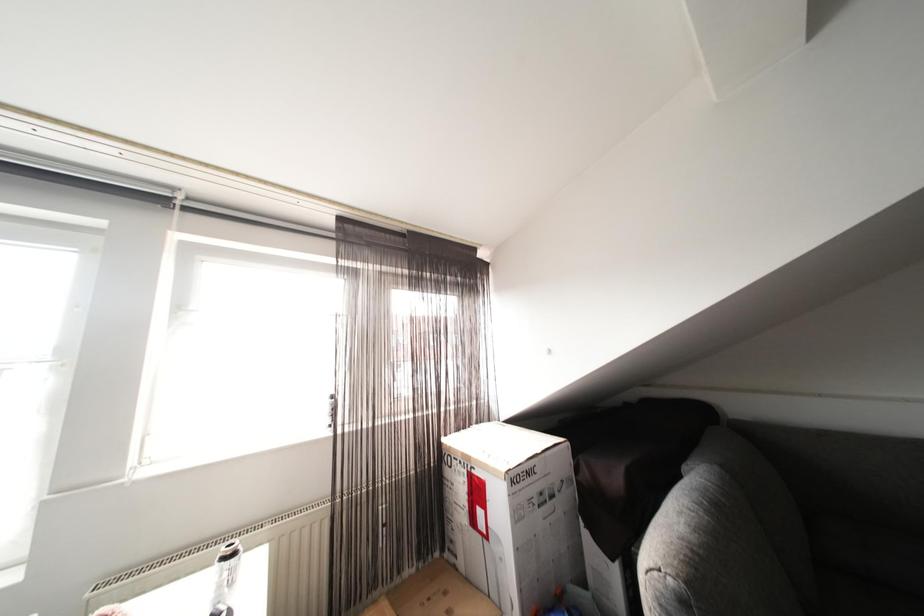
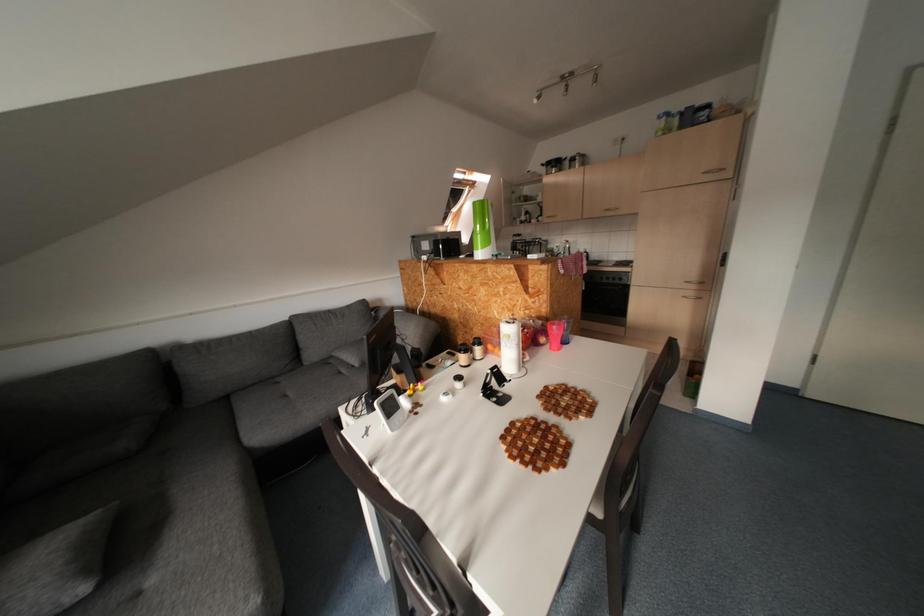
Question: The camera is either moving clockwise (left) or counter-clockwise (right) around the object. The first image is from the beginning of the video and the second image is from the end. Is the camera moving left or right when shooting the video?

Choices:
 (A) Left
 (B) Right

Answer: (A)